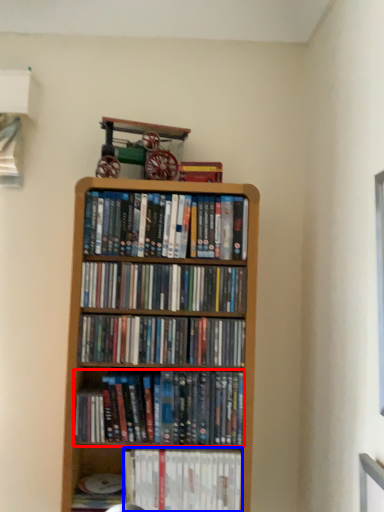
Question: Which point is closer to the camera, book (highlighted by a red box) or book (highlighted by a blue box)?

Choices:
 (A) book
 (B) book

Answer: (A)